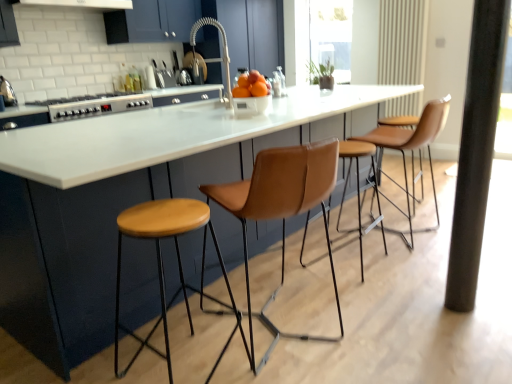
Question: Based on their positions, is satin nickel faucet at center located to the left or right of silver metallic stove at left?

Choices:
 (A) left
 (B) right

Answer: (B)

Question: Based on their sizes in the image, would you say satin nickel faucet at center is bigger or smaller than silver metallic stove at left?

Choices:
 (A) big
 (B) small

Answer: (B)

Question: Which object is the farthest from the leather-like brown stool at right, the 2th chair viewed from the left?

Choices:
 (A) silver metallic stove at left
 (B) transparent glass window screen at upper center
 (C) metallic silver kettle at left
 (D) satin nickel faucet at center
 (E) leather at center, which appears as the first chair when viewed from the left

Answer: (B)

Question: Estimate the real-world distances between objects in this image. Which object is farther from the leather at center, which is counted as the first chair, starting from the front?

Choices:
 (A) leather-like brown stool at right, the 2th chair viewed from the left
 (B) metallic silver kettle at left
 (C) transparent glass window screen at upper center
 (D) wooden stool at center
 (E) satin nickel faucet at center

Answer: (C)